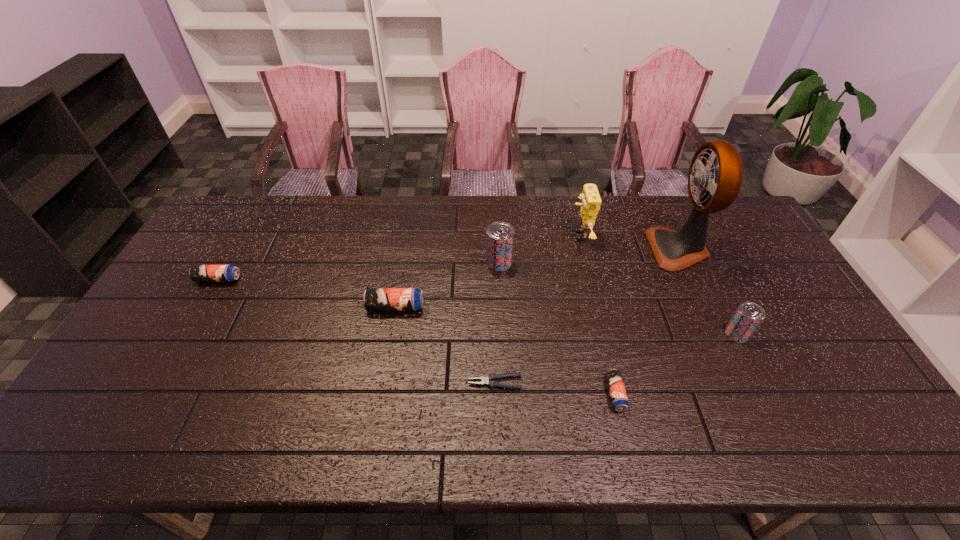
Identify the location of free space located 0.230m on the face of the seventh shortest object. This screenshot has width=960, height=540. (502, 236).

Find the location of a particular element. This screenshot has height=540, width=960. free spot located 0.360m on the front of the left red beer can is located at coordinates (504, 370).

Where is `vacant region located 0.210m on the back of the smaller red beer can`? This screenshot has height=540, width=960. vacant region located 0.210m on the back of the smaller red beer can is located at coordinates (706, 272).

The image size is (960, 540). I want to click on free space located on the back of the second beer can from left to right, so click(410, 220).

At what (x,y) coordinates should I click in order to perform the action: click on free location located 0.110m on the front of the leftmost beer can. Please return your answer as a coordinate pair (x, y). The height and width of the screenshot is (540, 960). Looking at the image, I should click on (199, 313).

Where is `vacant space located on the back of the nearest beer can`? vacant space located on the back of the nearest beer can is located at coordinates (601, 333).

Where is `free spot located 0.400m at the gripping part of the shortest object`? This screenshot has height=540, width=960. free spot located 0.400m at the gripping part of the shortest object is located at coordinates (310, 383).

Find the location of a particular element. vacant region located 0.110m at the gripping part of the shortest object is located at coordinates (424, 383).

Find the location of a particular element. This screenshot has height=540, width=960. free space located 0.390m at the gripping part of the shortest object is located at coordinates (314, 383).

Identify the location of fan present at the far edge. (674, 250).